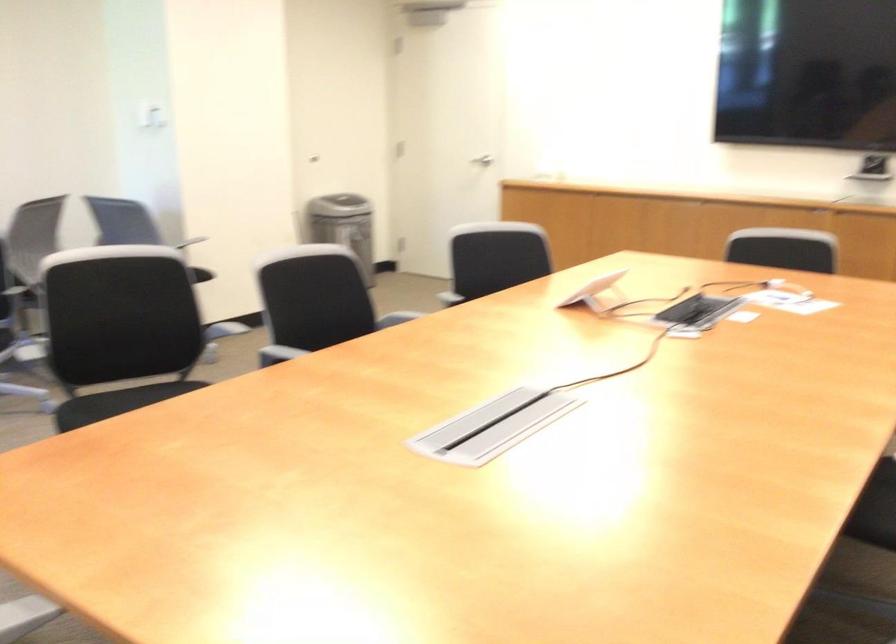
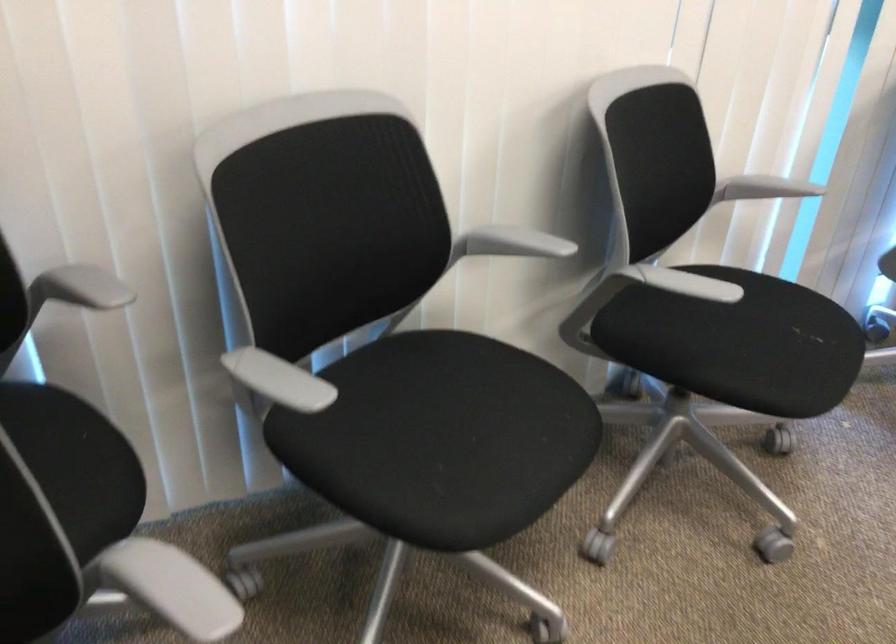
First-person continuous shooting, in which direction is the camera rotating?

The camera's rotation is toward left-down.